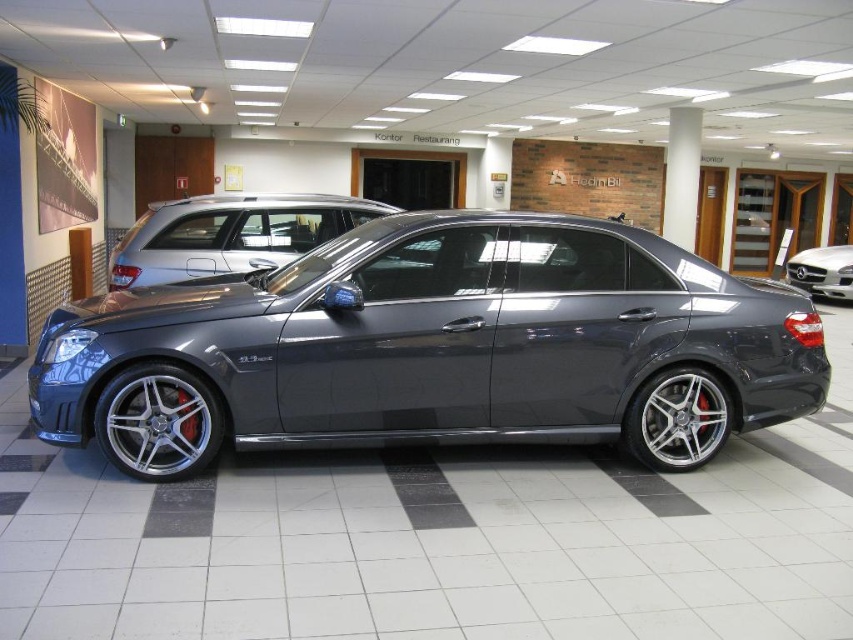
Question: Which of the following is the closest to the observer?

Choices:
 (A) satin metallic car at center
 (B) satin metallic sedan at center

Answer: (A)

Question: Is satin metallic car at center to the left of satin metallic sedan at center from the viewer's perspective?

Choices:
 (A) no
 (B) yes

Answer: (A)

Question: Among these points, which one is nearest to the camera?

Choices:
 (A) (404, 221)
 (B) (836, 252)
 (C) (241, 198)

Answer: (A)

Question: Is satin metallic sedan at center to the right of satin black sedan at center from the viewer's perspective?

Choices:
 (A) no
 (B) yes

Answer: (A)

Question: Does satin metallic car at center come behind satin black sedan at center?

Choices:
 (A) no
 (B) yes

Answer: (A)

Question: Which point appears farthest from the camera in this image?

Choices:
 (A) (149, 227)
 (B) (668, 436)
 (C) (808, 262)

Answer: (C)